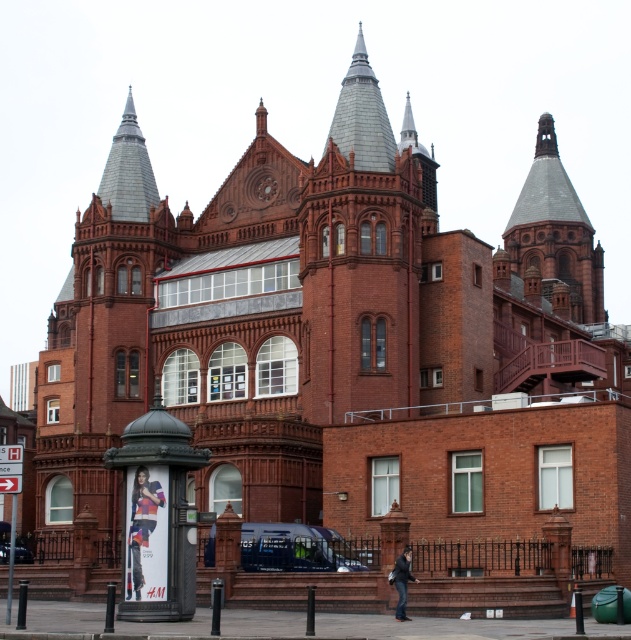
Is shiny silver spire at upper center positioned at the back of shiny metallic spire at upper left?

No, shiny silver spire at upper center is closer to the viewer.

Is shiny silver spire at upper center shorter than shiny metallic spire at upper left?

Incorrect, shiny silver spire at upper center's height does not fall short of shiny metallic spire at upper left's.

Is point (360, 83) farther from viewer compared to point (115, 138)?

No, it is not.

The width and height of the screenshot is (631, 640). In order to click on shiny silver spire at upper center in this screenshot , I will do `click(362, 116)`.

Is multicolored fabric poster at center further to camera compared to dark blue leather jacket at lower center?

No, it is in front of dark blue leather jacket at lower center.

Does point (138, 554) come behind point (408, 566)?

That is False.

The height and width of the screenshot is (640, 631). I want to click on multicolored fabric poster at center, so click(146, 534).

Does shiny metallic spire at upper left appear over dark blue leather jacket at lower center?

Yes.

Which is more to the right, shiny metallic spire at upper left or dark blue leather jacket at lower center?

dark blue leather jacket at lower center is more to the right.

Image resolution: width=631 pixels, height=640 pixels. I want to click on shiny metallic spire at upper left, so click(x=127, y=172).

I want to click on shiny metallic spire at upper left, so click(x=127, y=172).